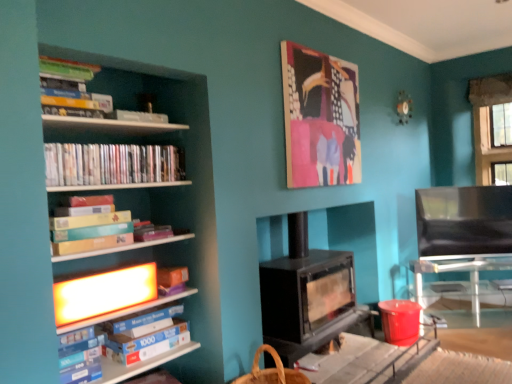
In order to face black leather armchair at right, should I rotate leftwards or rightwards?

Rotate your view right by about 26.020°.

Describe the element at coordinates (464, 220) in the screenshot. I see `black leather armchair at right` at that location.

I want to click on matte cardboard book at left, which is counted as the second book, starting from the top, so click(x=90, y=232).

What do you see at coordinates (320, 118) in the screenshot? I see `canvas painting at upper center` at bounding box center [320, 118].

Measure the distance between point (322, 70) and camera.

A distance of 9.76 feet exists between point (322, 70) and camera.

At what (x,y) coordinates should I click in order to perform the action: click on black leather armchair at right. Please return your answer as a coordinate pair (x, y). Image resolution: width=512 pixels, height=384 pixels. Looking at the image, I should click on (464, 220).

From a real-world perspective, does white glossy shelves at left sit lower than matte cardboard book at left, which is counted as the second book, starting from the bottom?

Yes, from a real-world perspective, white glossy shelves at left is under matte cardboard book at left, which is counted as the second book, starting from the bottom.

Is point (158, 78) farther from viewer compared to point (115, 245)?

Yes, it is.

Is white glossy shelves at left taller than matte cardboard book at left, which is counted as the second book, starting from the top?

Yes.

Which object is closer to the camera, white glossy shelves at left or matte cardboard book at left, which is counted as the second book, starting from the top?

white glossy shelves at left is in front.

Are blue cardboard box at left and white glossy shelves at left beside each other?

No, blue cardboard box at left is not in contact with white glossy shelves at left.

Does blue cardboard box at left have a greater height compared to white glossy shelves at left?

In fact, blue cardboard box at left may be shorter than white glossy shelves at left.

Does blue cardboard box at left have a larger size compared to white glossy shelves at left?

No, blue cardboard box at left is not bigger than white glossy shelves at left.

From a real-world perspective, relative to white glossy shelves at left, is blue cardboard box at left vertically above or below?

From a real-world perspective, blue cardboard box at left is physically below white glossy shelves at left.

Is clear glass table at lower right positioned beyond the bounds of matte plastic dvds at left, which ranks as the 1th book in top-to-bottom order?

clear glass table at lower right lies outside matte plastic dvds at left, which ranks as the 1th book in top-to-bottom order,'s area.

How far apart are clear glass table at lower right and matte plastic dvds at left, which ranks as the 1th book in top-to-bottom order?

They are 2.82 meters apart.

Considering the positions of point (452, 319) and point (80, 185), is point (452, 319) closer or farther from the camera than point (80, 185)?

Point (452, 319).

In the scene shown: From a real-world perspective, which is physically above, clear glass table at lower right or matte plastic dvds at left, which ranks as the 1th book in top-to-bottom order?

matte plastic dvds at left, which ranks as the 1th book in top-to-bottom order.

Would you say black leather armchair at right is a long distance from matte cardboard book at left, which is counted as the second book, starting from the bottom?

Yes, black leather armchair at right and matte cardboard book at left, which is counted as the second book, starting from the bottom, are quite far apart.

Is black leather armchair at right at the right side of matte cardboard book at left, which is counted as the second book, starting from the bottom?

Yes, black leather armchair at right is to the right of matte cardboard book at left, which is counted as the second book, starting from the bottom.

Would you say black leather armchair at right is outside matte cardboard book at left, which is counted as the second book, starting from the top?

Yes, black leather armchair at right is outside of matte cardboard book at left, which is counted as the second book, starting from the top.

Does black leather armchair at right turn towards matte cardboard book at left, which is counted as the second book, starting from the top?

No.

Is the surface of blue cardboard box at left in direct contact with canvas painting at upper center?

No, blue cardboard box at left is not beside canvas painting at upper center.

From the picture: What's the angular difference between blue cardboard box at left and canvas painting at upper center's facing directions?

5.28 degrees separate the facing orientations of blue cardboard box at left and canvas painting at upper center.

Considering the sizes of blue cardboard box at left and canvas painting at upper center in the image, is blue cardboard box at left wider or thinner than canvas painting at upper center?

In the image, blue cardboard box at left appears to be wider than canvas painting at upper center.

From a real-world perspective, is blue cardboard box at left located beneath canvas painting at upper center?

Yes, from a real-world perspective, blue cardboard box at left is below canvas painting at upper center.

Can we say canvas painting at upper center lies outside black leather armchair at right?

Absolutely, canvas painting at upper center is external to black leather armchair at right.

Can you confirm if canvas painting at upper center is shorter than black leather armchair at right?

Incorrect, the height of canvas painting at upper center does not fall short of that of black leather armchair at right.

Is canvas painting at upper center oriented away from black leather armchair at right?

No, black leather armchair at right is not at the back of canvas painting at upper center.

From the picture: From a real-world perspective, which object rests below the other?

black leather armchair at right is physically lower.

From a real-world perspective, relative to black matte wood burning stove at center, is white glossy shelves at left vertically above or below?

white glossy shelves at left is above black matte wood burning stove at center.

Would you say white glossy shelves at left is outside black matte wood burning stove at center?

white glossy shelves at left is positioned outside black matte wood burning stove at center.

Would you say white glossy shelves at left is a long distance from black matte wood burning stove at center?

That's right, there is a large distance between white glossy shelves at left and black matte wood burning stove at center.

Can you tell me how much white glossy shelves at left and black matte wood burning stove at center differ in facing direction?

They differ by 2.03 degrees in their facing directions.

Find the location of a particular element. This screenshot has width=512, height=384. shelf that appears below the matte cardboard book at left, which is counted as the second book, starting from the top (from a real-world perspective) is located at coordinates (164, 190).

What are the coordinates of `shelf lying above the blue cardboard box at left (from the image's perspective)` in the screenshot? It's located at (164, 190).

Which object lies further to the anchor point white glossy shelves at left, matte cardboard book at left, which is counted as the second book, starting from the bottom, or blue cardboard box at left?

Based on the image, blue cardboard box at left appears to be further to white glossy shelves at left.

When comparing their distances from canvas painting at upper center, does white glossy shelves at left or black matte wood burning stove at center seem further?

Based on the image, white glossy shelves at left appears to be further to canvas painting at upper center.

Looking at the image, which one is located further to matte cardboard book at left, which is counted as the second book, starting from the top, black leather armchair at right or clear glass table at lower right?

clear glass table at lower right lies further to matte cardboard book at left, which is counted as the second book, starting from the top, than the other object.

When comparing their distances from black leather armchair at right, does white glossy shelves at left or matte plastic dvds at left, which ranks as the 1th book in top-to-bottom order, seem further?

matte plastic dvds at left, which ranks as the 1th book in top-to-bottom order, is further to black leather armchair at right.

Considering their positions, is blue cardboard box at left, arranged as the 1th book when ordered from the bottom, positioned further to clear glass table at lower right than matte plastic dvds at left, the 3th book in the bottom-to-top sequence?

blue cardboard box at left, arranged as the 1th book when ordered from the bottom, lies further to clear glass table at lower right than the other object.

Considering their positions, is clear glass table at lower right positioned closer to white glossy shelves at left than blue cardboard box at left?

Among the two, blue cardboard box at left is located nearer to white glossy shelves at left.

Based on their spatial positions, is black matte wood burning stove at center or white glossy shelves at left further from black leather armchair at right?

Among the two, white glossy shelves at left is located further to black leather armchair at right.

Which object lies further to the anchor point matte cardboard book at left, which is counted as the second book, starting from the top, blue cardboard box at left or black matte wood burning stove at center?

Based on the image, black matte wood burning stove at center appears to be further to matte cardboard book at left, which is counted as the second book, starting from the top.

Find the location of `shelf between blue cardboard box at left, the 3th book from the top, and canvas painting at upper center`. shelf between blue cardboard box at left, the 3th book from the top, and canvas painting at upper center is located at coordinates (164, 190).

You are a GUI agent. You are given a task and a screenshot of the screen. Output one action in this format:
    pyautogui.click(x=<x>, y=<y>)
    Task: Click on the paperback book between matte cardboard book at left, which is counted as the second book, starting from the bottom, and clear glass table at lower right
    The height and width of the screenshot is (384, 512).
    Given the screenshot: What is the action you would take?
    pyautogui.click(x=148, y=338)

Where is `armchair between white glossy shelves at left and clear glass table at lower right from left to right`? armchair between white glossy shelves at left and clear glass table at lower right from left to right is located at coordinates (464, 220).

This screenshot has height=384, width=512. Identify the location of wood burning stove between blue cardboard box at left, the 3th book from the top, and canvas painting at upper center, in the horizontal direction. (307, 295).